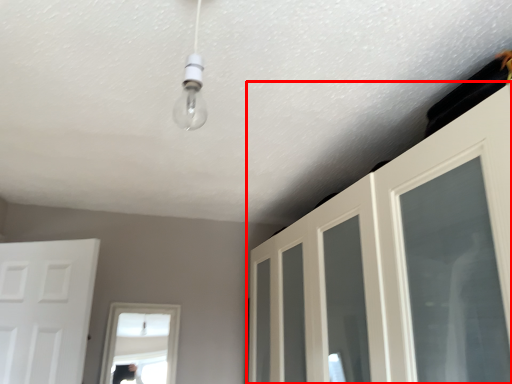
Question: Considering the relative positions of door (annotated by the red box) and door in the image provided, where is door (annotated by the red box) located with respect to the staircase?

Choices:
 (A) left
 (B) right

Answer: (B)